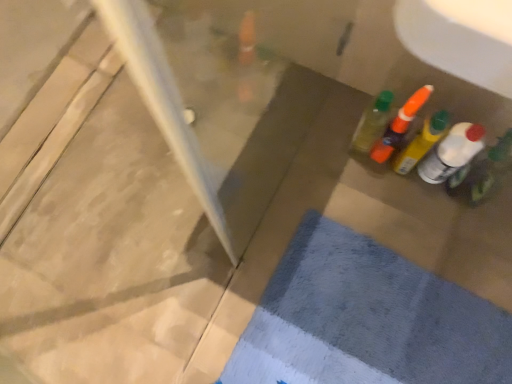
Question: Is blue textured bath mat at lower right closer to the viewer compared to translucent orange bottle at upper right, the second bottle when ordered from left to right?

Choices:
 (A) yes
 (B) no

Answer: (A)

Question: Can we say blue textured bath mat at lower right lies outside translucent orange bottle at upper right, the second bottle when ordered from left to right?

Choices:
 (A) yes
 (B) no

Answer: (A)

Question: Is blue textured bath mat at lower right thinner than translucent orange bottle at upper right, the 3th bottle when ordered from right to left?

Choices:
 (A) no
 (B) yes

Answer: (A)

Question: Is the surface of blue textured bath mat at lower right in direct contact with translucent orange bottle at upper right, the 3th bottle when ordered from right to left?

Choices:
 (A) yes
 (B) no

Answer: (B)

Question: Is blue textured bath mat at lower right surrounding translucent orange bottle at upper right, the 3th bottle when ordered from right to left?

Choices:
 (A) yes
 (B) no

Answer: (B)

Question: From a real-world perspective, is blue textured bath mat at lower right located higher than translucent orange bottle at upper right, the second bottle when ordered from left to right?

Choices:
 (A) yes
 (B) no

Answer: (B)

Question: Is translucent plastic bottle at right, the fourth bottle positioned from the left, next to translucent plastic bottle at right, acting as the first bottle starting from the left?

Choices:
 (A) no
 (B) yes

Answer: (A)

Question: Is translucent plastic bottle at right, which ranks as the first bottle in right-to-left order, to the right of translucent plastic bottle at right, acting as the first bottle starting from the left, from the viewer's perspective?

Choices:
 (A) yes
 (B) no

Answer: (A)

Question: Is translucent plastic bottle at right, which ranks as the first bottle in right-to-left order, wider than translucent plastic bottle at right, arranged as the 4th bottle when viewed from the right?

Choices:
 (A) no
 (B) yes

Answer: (A)

Question: From the image's perspective, would you say translucent plastic bottle at right, which ranks as the first bottle in right-to-left order, is shown under translucent plastic bottle at right, acting as the first bottle starting from the left?

Choices:
 (A) no
 (B) yes

Answer: (B)

Question: Is translucent plastic bottle at right, arranged as the 4th bottle when viewed from the right, located within translucent plastic bottle at right, the fourth bottle positioned from the left?

Choices:
 (A) yes
 (B) no

Answer: (B)

Question: Is there a large distance between translucent plastic bottle at right, the fourth bottle positioned from the left, and translucent plastic bottle at right, arranged as the 4th bottle when viewed from the right?

Choices:
 (A) yes
 (B) no

Answer: (B)

Question: Can blue textured bath mat at lower right be found inside translucent plastic bottle at right, the third bottle in the left-to-right sequence?

Choices:
 (A) yes
 (B) no

Answer: (B)